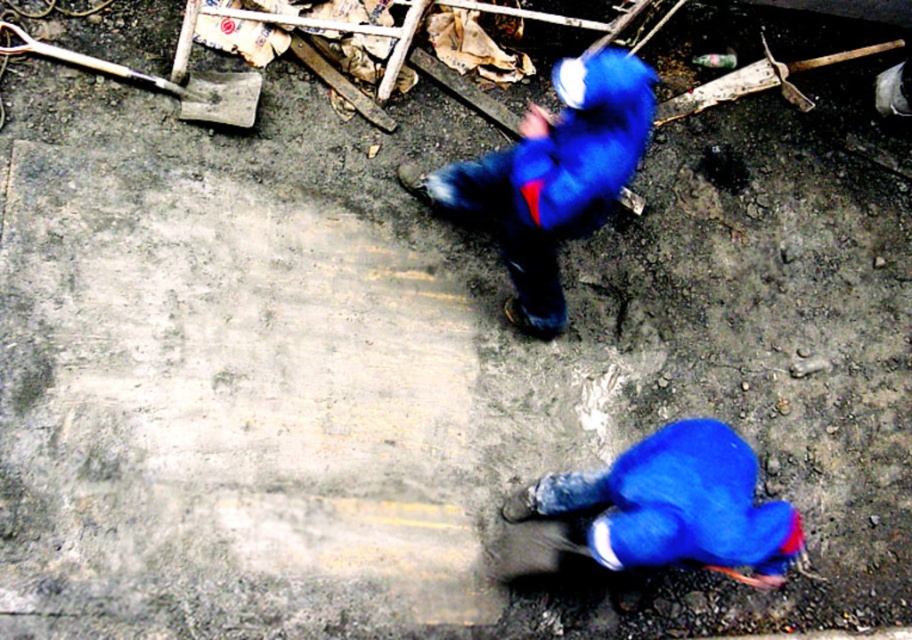
Question: Can you confirm if blue fabric construction worker at lower right is positioned to the right of blue fuzzy jacket at upper center?

Choices:
 (A) yes
 (B) no

Answer: (A)

Question: Is blue fuzzy jacket at upper center to the right of metallic silver shovel at upper left from the viewer's perspective?

Choices:
 (A) yes
 (B) no

Answer: (A)

Question: Considering the real-world distances, which object is closest to the metallic silver shovel at upper left?

Choices:
 (A) blue fuzzy jacket at upper center
 (B) blue fabric construction worker at lower right

Answer: (A)

Question: Estimate the real-world distances between objects in this image. Which object is closer to the metallic silver shovel at upper left?

Choices:
 (A) blue fabric construction worker at lower right
 (B) blue fuzzy jacket at upper center

Answer: (B)

Question: Which of these objects is positioned farthest from the blue fabric construction worker at lower right?

Choices:
 (A) blue fuzzy jacket at upper center
 (B) metallic silver shovel at upper left

Answer: (B)

Question: Is blue fabric construction worker at lower right behind blue fuzzy jacket at upper center?

Choices:
 (A) no
 (B) yes

Answer: (A)